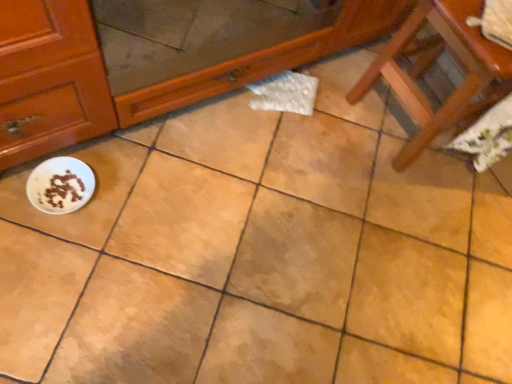
At what (x,y) coordinates should I click in order to perform the action: click on vacant space in front of white glossy bowl at lower left. Please return your answer as a coordinate pair (x, y). This screenshot has width=512, height=384. Looking at the image, I should click on (48, 254).